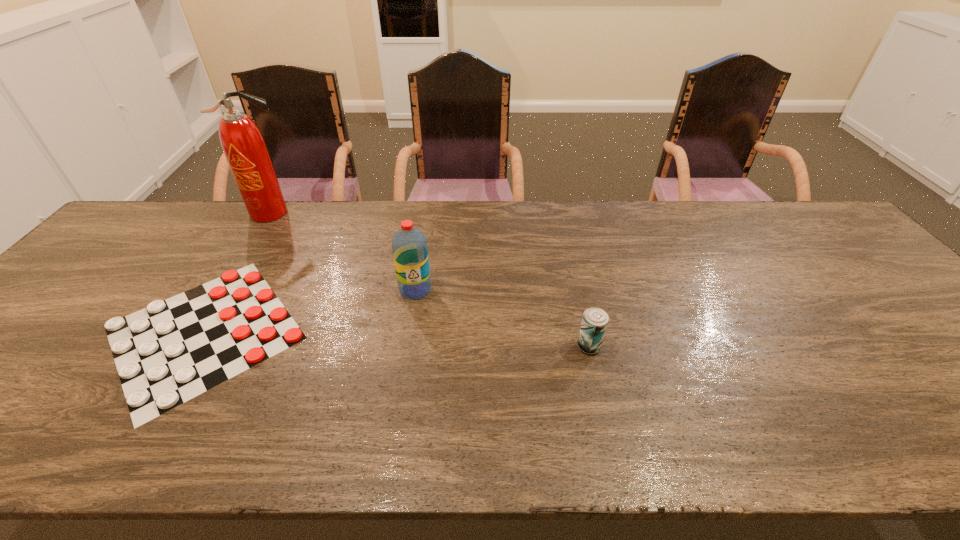
Locate an element on the screen. The height and width of the screenshot is (540, 960). vacant area situated 0.100m on the right of the shortest object is located at coordinates (351, 332).

I want to click on object that is at the far edge, so click(x=244, y=147).

Identify the location of object located in the near edge section of the desktop. This screenshot has width=960, height=540. (184, 348).

In the image, there is a desktop. Identify the location of free space at the far edge. (685, 229).

The height and width of the screenshot is (540, 960). Find the location of `free region at the near edge`. free region at the near edge is located at coordinates (754, 430).

You are a GUI agent. You are given a task and a screenshot of the screen. Output one action in this format:
    pyautogui.click(x=<x>, y=<y>)
    Task: Click on the free location at the right edge of the desktop
    The width and height of the screenshot is (960, 540).
    Given the screenshot: What is the action you would take?
    pyautogui.click(x=916, y=316)

Where is `vacant space that's between the farthest object and the second object from right to left`? The width and height of the screenshot is (960, 540). vacant space that's between the farthest object and the second object from right to left is located at coordinates (344, 251).

Image resolution: width=960 pixels, height=540 pixels. I want to click on vacant space that is in between the checkerboard and the rightmost object, so click(x=396, y=339).

Locate an element on the screen. empty location between the checkerboard and the farthest object is located at coordinates (238, 272).

Find the location of `free spot between the checkerboard and the third object from left to right`. free spot between the checkerboard and the third object from left to right is located at coordinates (310, 310).